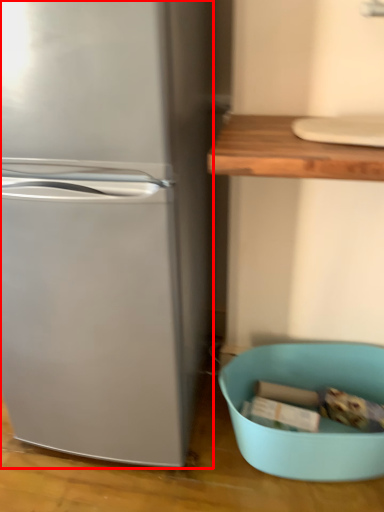
Question: From the image's perspective, where is refrigerator (annotated by the red box) located in relation to mixing bowl in the image?

Choices:
 (A) above
 (B) below

Answer: (A)